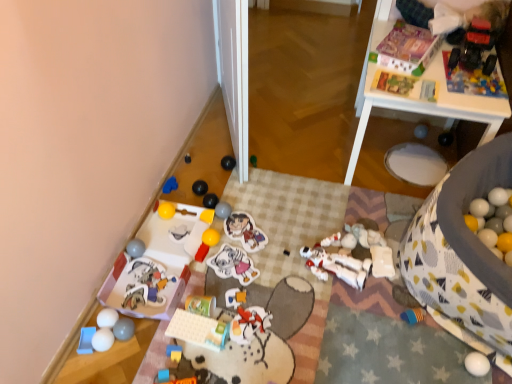
This screenshot has width=512, height=384. In order to click on free space between matte plastic sticker at center, the 20th toy when ordered from left to right, and rubber yellow block at lower center, marked as the eleventh toy in a left-to-right arrangement in this screenshot , I will do `click(220, 276)`.